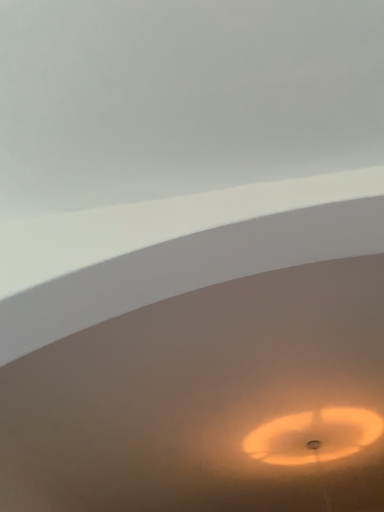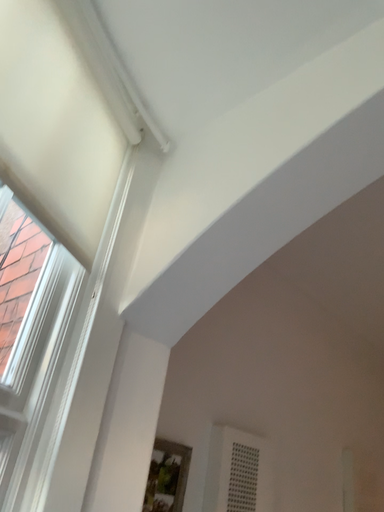
Question: Which way did the camera rotate in the video?

Choices:
 (A) rotated downward
 (B) rotated upward

Answer: (A)